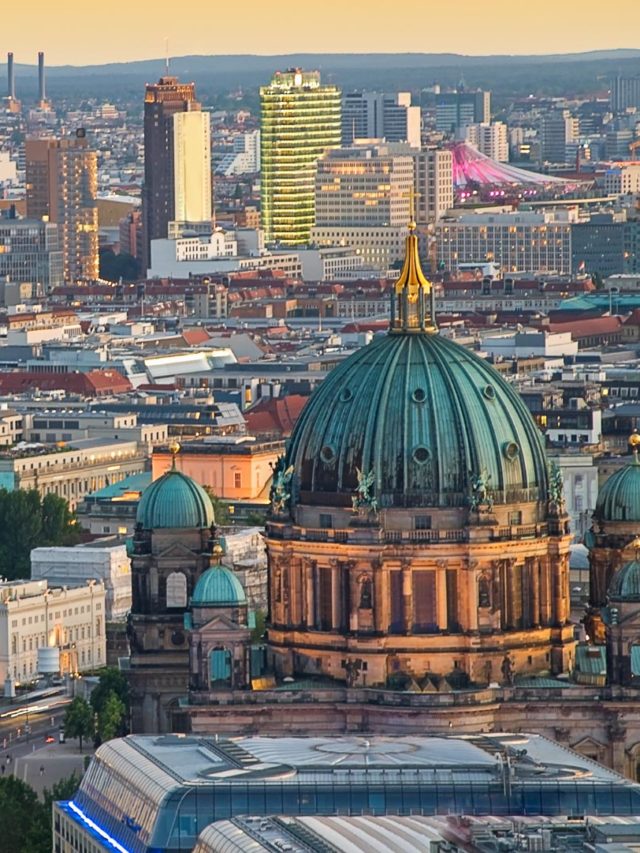
Locate an element on the screen. The height and width of the screenshot is (853, 640). windows is located at coordinates (419, 520), (324, 520), (516, 514).